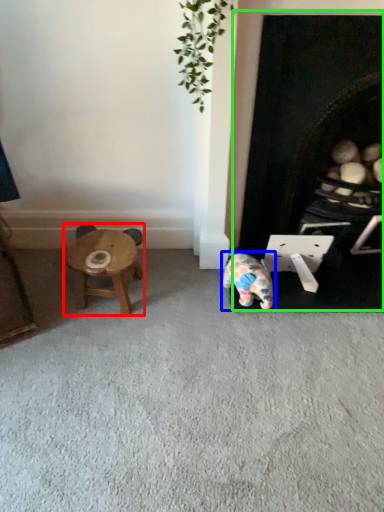
Question: Considering the real-world distances, which object is farthest from stool (highlighted by a red box)? toy (highlighted by a blue box) or fireplace (highlighted by a green box)?

Choices:
 (A) toy
 (B) fireplace

Answer: (B)